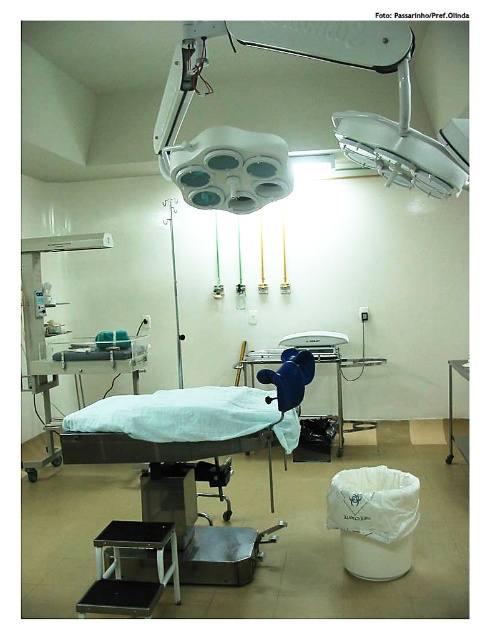
Who is higher up, black plastic stool at lower left or blue plastic chair at center?

blue plastic chair at center

Can you confirm if black plastic stool at lower left is positioned above blue plastic chair at center?

Incorrect, black plastic stool at lower left is not positioned above blue plastic chair at center.

Where is `black plastic stool at lower left`? black plastic stool at lower left is located at coordinates pos(121,570).

Image resolution: width=490 pixels, height=640 pixels. What do you see at coordinates (195, 456) in the screenshot?
I see `white matte bed at center` at bounding box center [195, 456].

The height and width of the screenshot is (640, 490). What are the coordinates of `white matte bed at center` in the screenshot? It's located at (195, 456).

Where is `white matte bed at center`? white matte bed at center is located at coordinates tap(195, 456).

Does point (105, 548) lie behind point (460, 442)?

No, it is in front of (460, 442).

Can you confirm if black plastic stool at lower left is taller than white plastic trash can at lower right?

In fact, black plastic stool at lower left may be shorter than white plastic trash can at lower right.

The image size is (490, 640). Identify the location of black plastic stool at lower left. (121, 570).